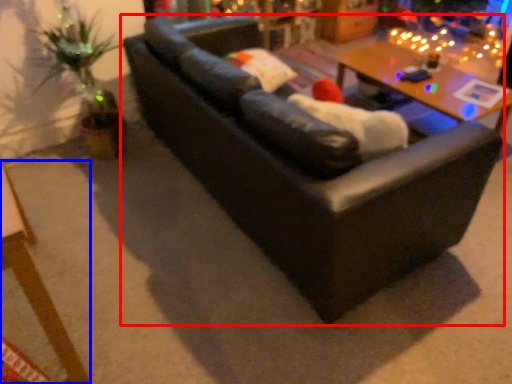
Question: Among these objects, which one is farthest to the camera, studio couch (highlighted by a red box) or table (highlighted by a blue box)?

Choices:
 (A) studio couch
 (B) table

Answer: (A)